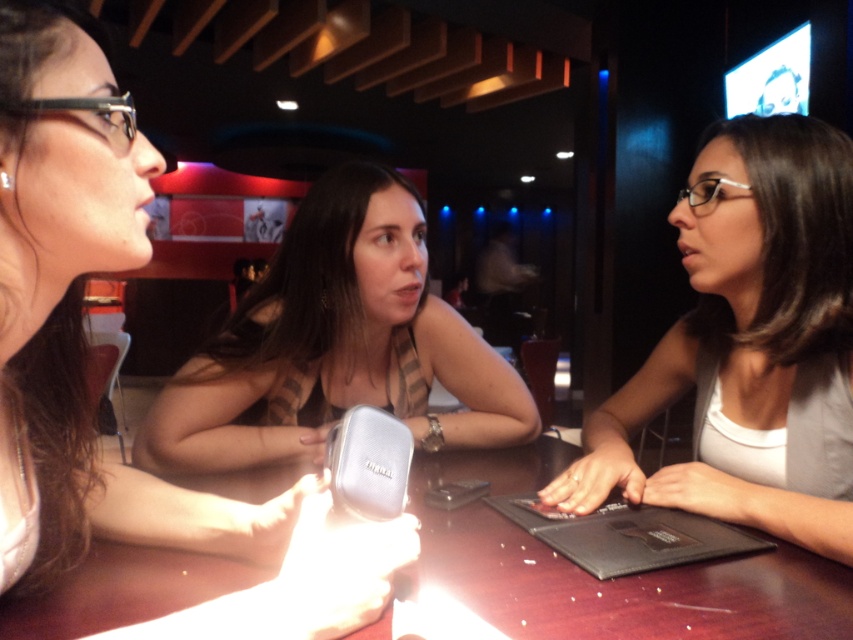
You are a delivery person who needs to place a small package on the table in the image. The package must be placed exactly at the coordinates given for the black matte laptop at center. Where should you place the package relative to the women sitting around the table?

The black matte laptop at center is located at point coordinates (628, 536). Since the coordinate system is not specified, but assuming it is relative to the image frame, the package should be placed at the center of the table where the black matte laptop is positioned.

You are a delivery person who needs to place a small package on the table between the black matte laptop at center and the silver metallic phone at center. Can you fit the package there if it is 15 cm in length?

The black matte laptop at center is larger than the silver metallic phone at center. Since the package is 15 cm long, it can be placed between them as there is sufficient space available between the two items.